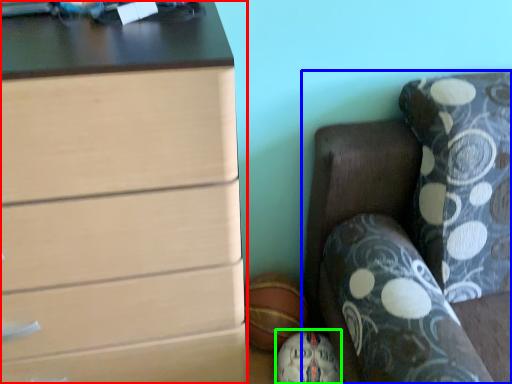
Question: Which object is the closest to the chest of drawers (highlighted by a red box)? Choose among these: furniture (highlighted by a blue box) or sports equipment (highlighted by a green box).

Choices:
 (A) furniture
 (B) sports equipment

Answer: (A)